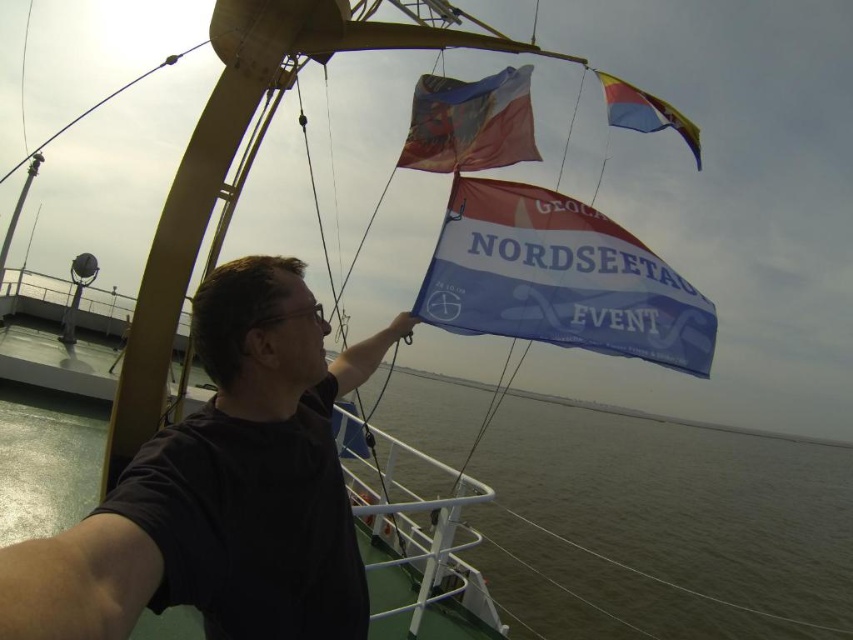
Is blue fabric flag at center taller than polyester flag at upper right?

Correct, blue fabric flag at center is much taller as polyester flag at upper right.

Who is more distant from viewer, (x=494, y=284) or (x=633, y=97)?

Point (x=633, y=97)

This screenshot has height=640, width=853. In order to click on blue fabric flag at center in this screenshot , I will do (560, 278).

Does black matte shirt at center appear on the right side of blue fabric flag at center?

No, black matte shirt at center is not to the right of blue fabric flag at center.

Image resolution: width=853 pixels, height=640 pixels. What do you see at coordinates (222, 490) in the screenshot?
I see `black matte shirt at center` at bounding box center [222, 490].

In order to click on black matte shirt at center in this screenshot , I will do `click(222, 490)`.

Can you confirm if multicolored fabric flag at upper center is bigger than polyester flag at upper right?

Indeed, multicolored fabric flag at upper center has a larger size compared to polyester flag at upper right.

Does multicolored fabric flag at upper center have a lesser height compared to polyester flag at upper right?

No.

Locate an element on the screen. multicolored fabric flag at upper center is located at coordinates (469, 122).